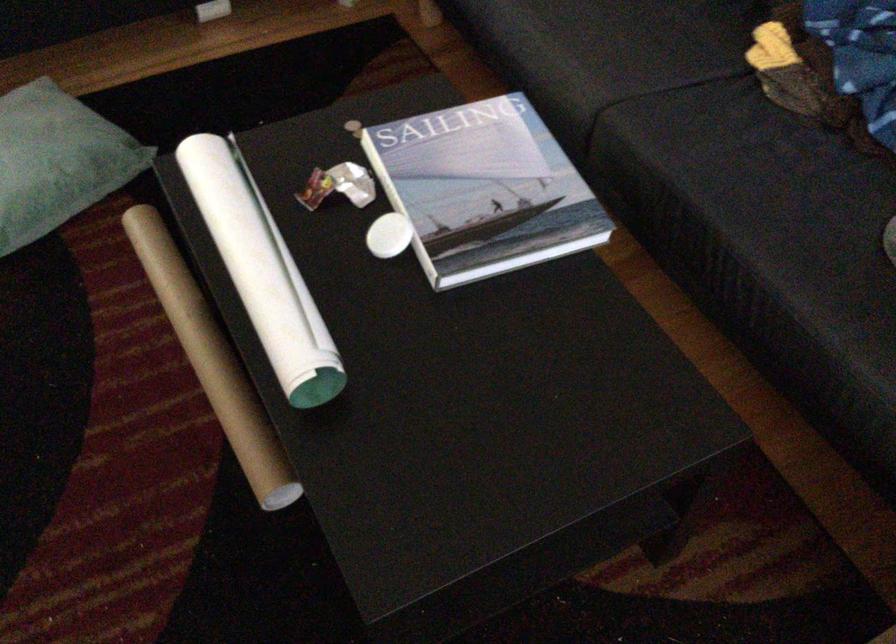
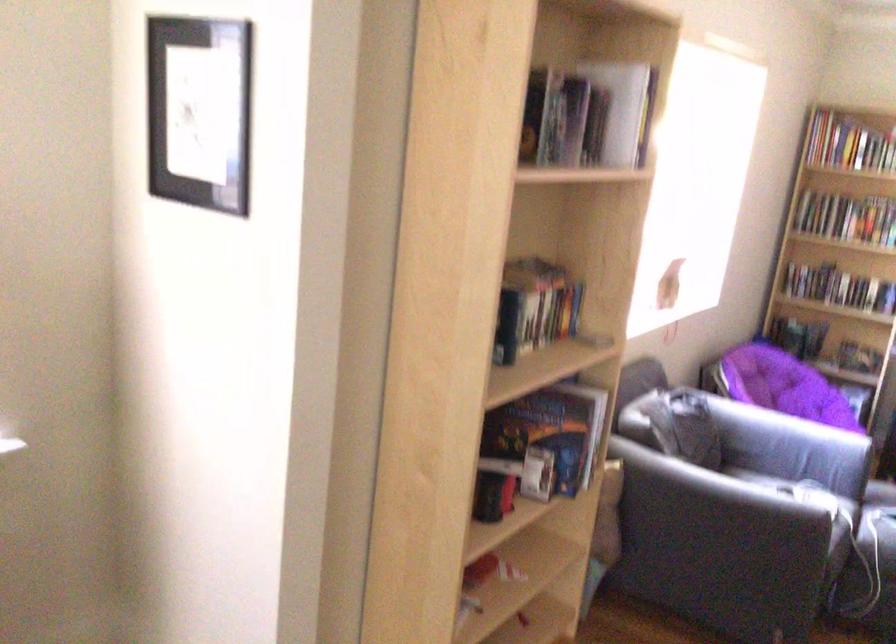
Question: The first image is from the beginning of the video and the second image is from the end. How did the camera likely rotate when shooting the video?

Choices:
 (A) Left
 (B) Right
 (C) Up
 (D) Down

Answer: (A)